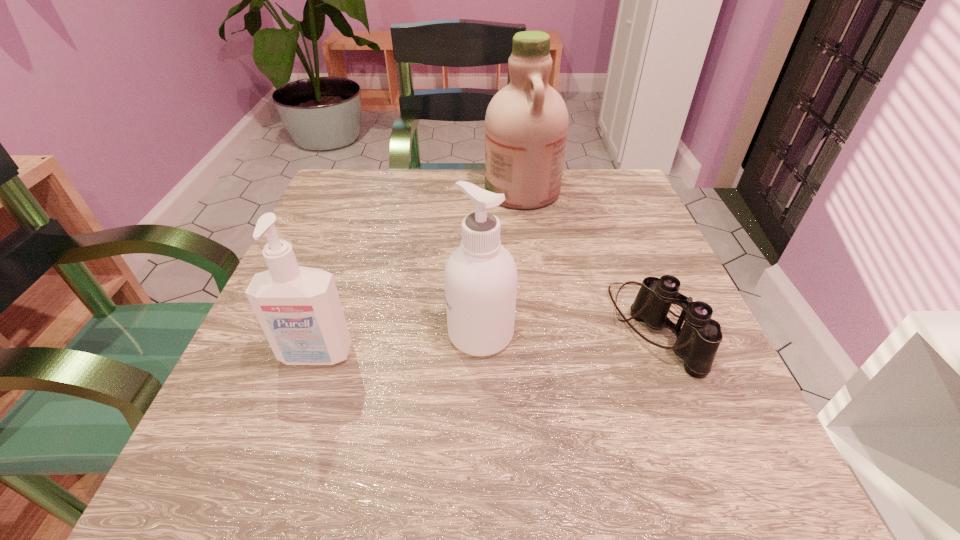
Where is `object at the far edge`? The image size is (960, 540). object at the far edge is located at coordinates (526, 123).

At what (x,y) coordinates should I click in order to perform the action: click on object at the left edge. Please return your answer as a coordinate pair (x, y). Looking at the image, I should click on (299, 309).

You are a GUI agent. You are given a task and a screenshot of the screen. Output one action in this format:
    pyautogui.click(x=<x>, y=<y>)
    Task: Click on the object present at the right edge
    This screenshot has height=540, width=960.
    Given the screenshot: What is the action you would take?
    pyautogui.click(x=697, y=342)

Where is `vacant space at the far edge of the desktop`? The width and height of the screenshot is (960, 540). vacant space at the far edge of the desktop is located at coordinates (455, 214).

Identify the location of free space at the near edge. This screenshot has width=960, height=540. click(x=406, y=450).

Image resolution: width=960 pixels, height=540 pixels. In the image, there is a desktop. What are the coordinates of `free region at the left edge` in the screenshot? It's located at (372, 249).

In the image, there is a desktop. Where is `vacant space at the right edge`? Image resolution: width=960 pixels, height=540 pixels. vacant space at the right edge is located at coordinates (595, 276).

Find the location of a particular element. vacant area at the far right corner of the desktop is located at coordinates (620, 222).

This screenshot has width=960, height=540. In order to click on free space that is in between the binoculars and the tallest object in this screenshot , I will do `click(588, 260)`.

Identify the location of vacant area that lies between the farthest cleansing agent and the shortest object. (588, 260).